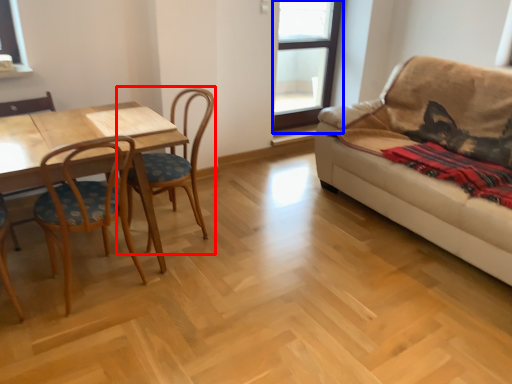
Question: Which of the following is the farthest to the observer, chair (highlighted by a red box) or window (highlighted by a blue box)?

Choices:
 (A) chair
 (B) window

Answer: (B)